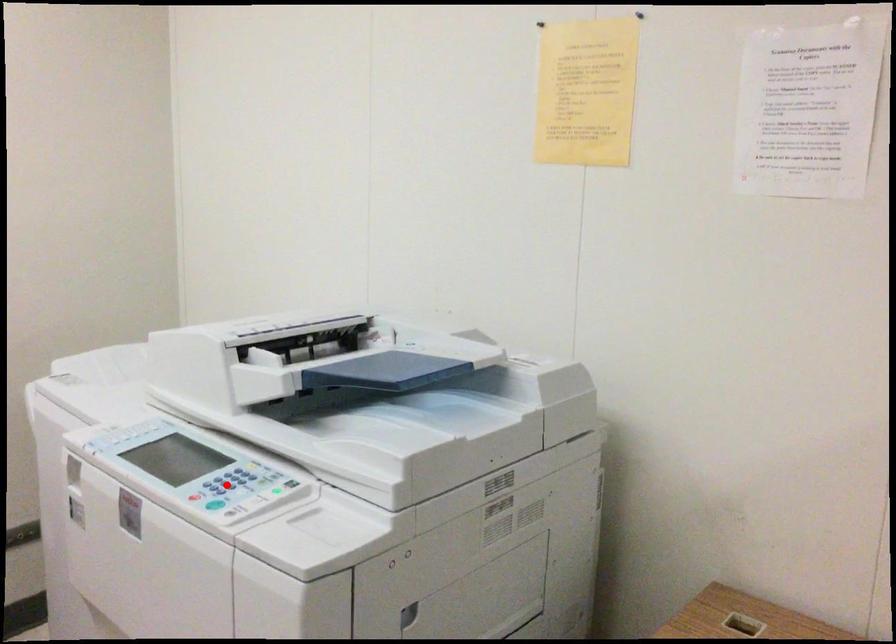
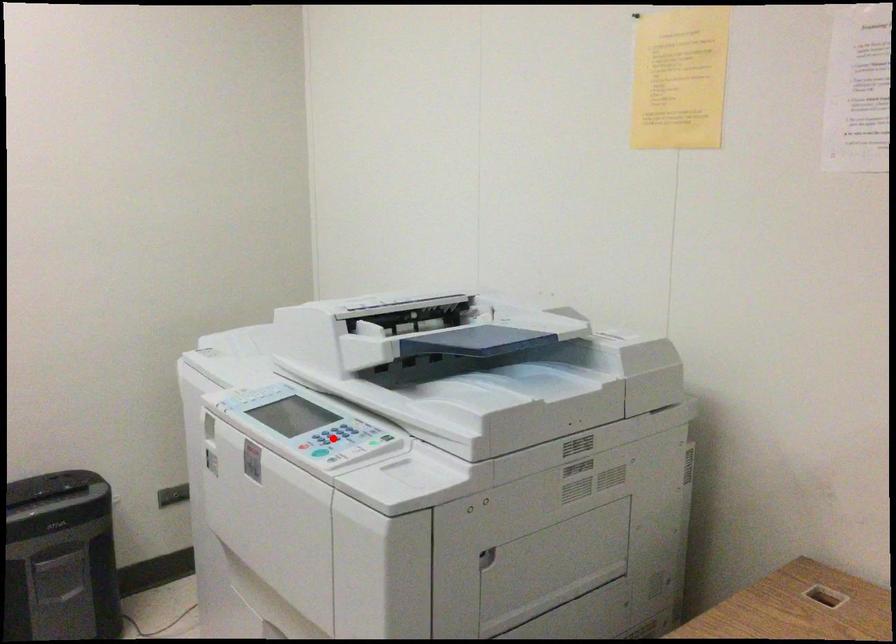
I am providing you with two images of the same scene from different viewpoints. A red point is marked on the first image and another point is marked on the second image. Do the highlighted points in image1 and image2 indicate the same real-world spot?

Yes